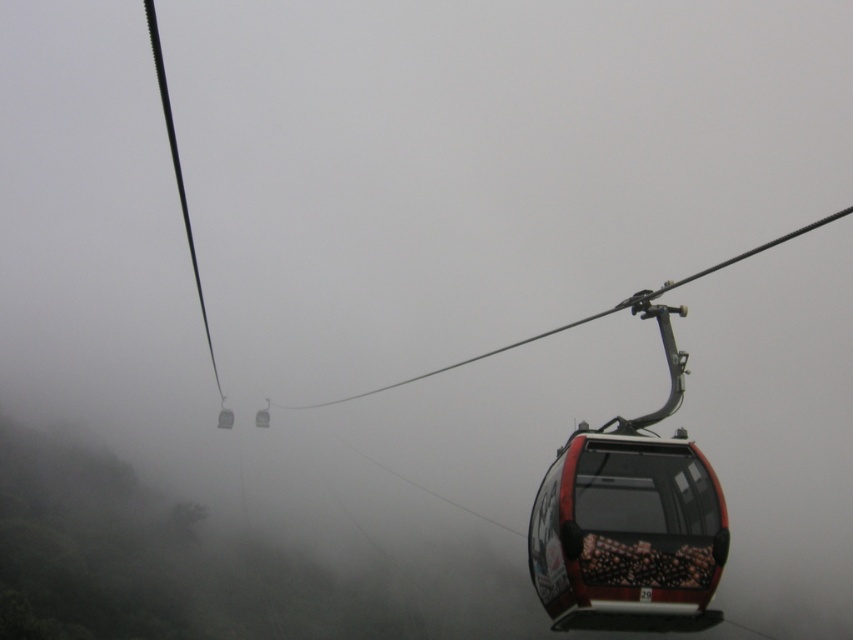
Question: Is the position of metallic gray cable car at center more distant than that of metallic cable car at center?

Choices:
 (A) no
 (B) yes

Answer: (A)

Question: Can you confirm if metallic red cable car at center is positioned to the right of metallic gray cable car at center?

Choices:
 (A) yes
 (B) no

Answer: (A)

Question: Is metallic red cable car at center positioned at the back of metallic cable car at center?

Choices:
 (A) no
 (B) yes

Answer: (A)

Question: Which point is farther to the camera?

Choices:
 (A) metallic cable car at center
 (B) metallic gray cable car at center
 (C) metallic red cable car at center

Answer: (A)

Question: Estimate the real-world distances between objects in this image. Which object is farther from the metallic gray cable car at center?

Choices:
 (A) metallic red cable car at center
 (B) metallic cable car at center

Answer: (A)

Question: Which point is closer to the camera?

Choices:
 (A) metallic red cable car at center
 (B) metallic cable car at center
 (C) metallic gray cable car at center

Answer: (A)